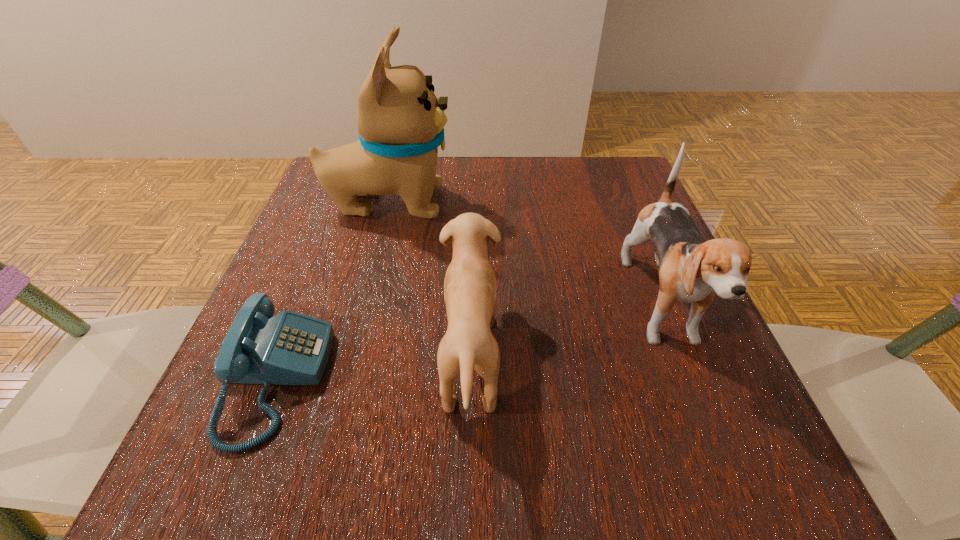
Where is `object at the far edge`? The image size is (960, 540). object at the far edge is located at coordinates (400, 121).

You are a GUI agent. You are given a task and a screenshot of the screen. Output one action in this format:
    pyautogui.click(x=<x>, y=<y>)
    Task: Click on the puppy that is at the near edge
    
    Given the screenshot: What is the action you would take?
    pyautogui.click(x=470, y=292)

Identify the location of telephone situated at the near edge. This screenshot has height=540, width=960. (290, 348).

What are the coordinates of `puppy that is at the left edge` in the screenshot? It's located at (400, 121).

Identify the location of telephone positioned at the left edge. (290, 348).

Identify the location of object at the right edge. (692, 270).

Find the location of a particular element. This screenshot has width=960, height=540. object at the far left corner is located at coordinates (400, 121).

Identify the location of object that is at the near left corner. click(290, 348).

You are a GUI agent. You are given a task and a screenshot of the screen. Output one action in this format:
    pyautogui.click(x=<x>, y=<y>)
    Task: Click on the vacant space at the far edge
    The width and height of the screenshot is (960, 540).
    Given the screenshot: What is the action you would take?
    pyautogui.click(x=465, y=191)

In the image, there is a desktop. Identify the location of vacant space at the near edge. (511, 488).